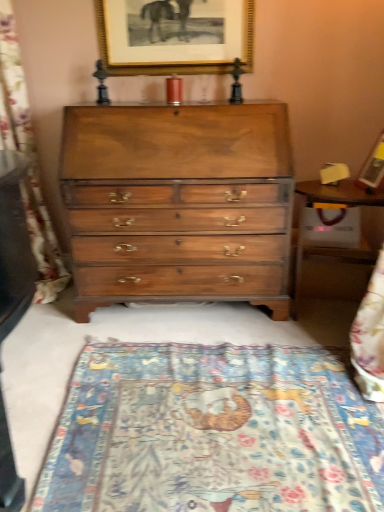
What are the coordinates of `vacant space underneath gold-framed picture at upper center, the 2th picture frame when ordered from bottom to top (from a real-world perspective)` in the screenshot? It's located at (173, 96).